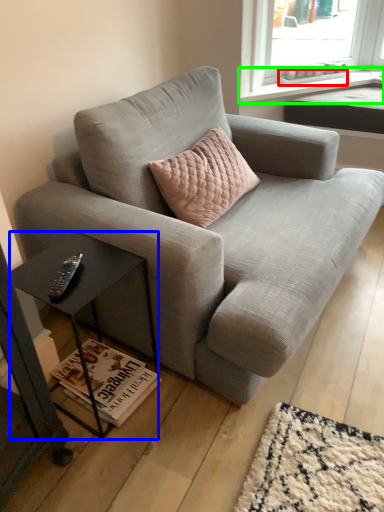
Question: Which is farther away from window sill (highlighted by a red box)? table (highlighted by a blue box) or window sill (highlighted by a green box)?

Choices:
 (A) table
 (B) window sill

Answer: (A)